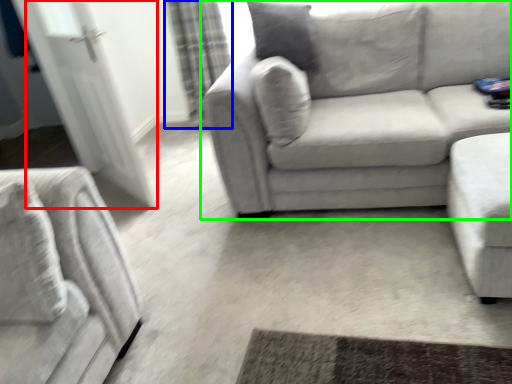
Question: Which object is positioned farthest from glass door (highlighted by a red box)? Select from curtain (highlighted by a blue box) and studio couch (highlighted by a green box).

Choices:
 (A) curtain
 (B) studio couch

Answer: (B)